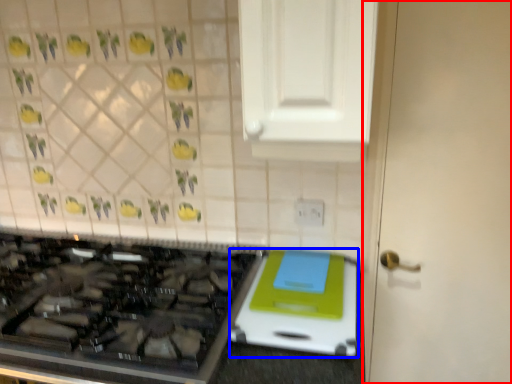
Question: Among these objects, which one is farthest to the camera, door (highlighted by a red box) or appliance (highlighted by a blue box)?

Choices:
 (A) door
 (B) appliance

Answer: (A)